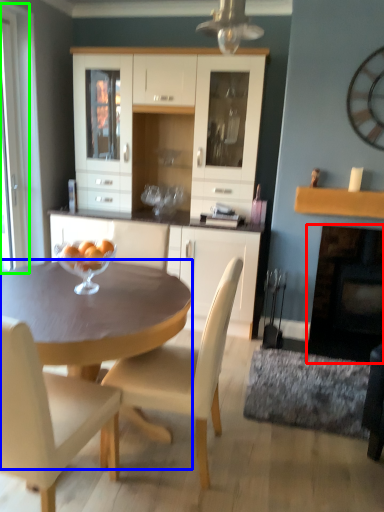
Question: Which object is positioned closest to fireplace (highlighted by a red box)? Select from desk (highlighted by a blue box) and screen door (highlighted by a green box).

Choices:
 (A) desk
 (B) screen door

Answer: (A)